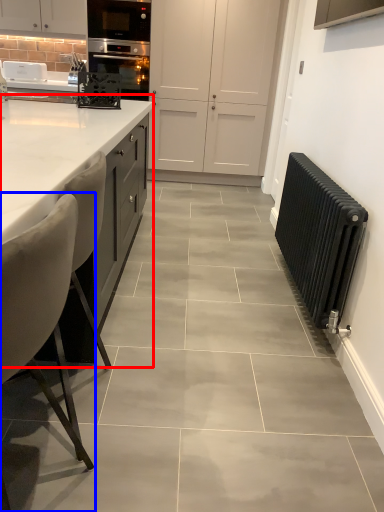
Question: Which object appears closest to the camera in this image, countertop (highlighted by a red box) or chair (highlighted by a blue box)?

Choices:
 (A) countertop
 (B) chair

Answer: (B)